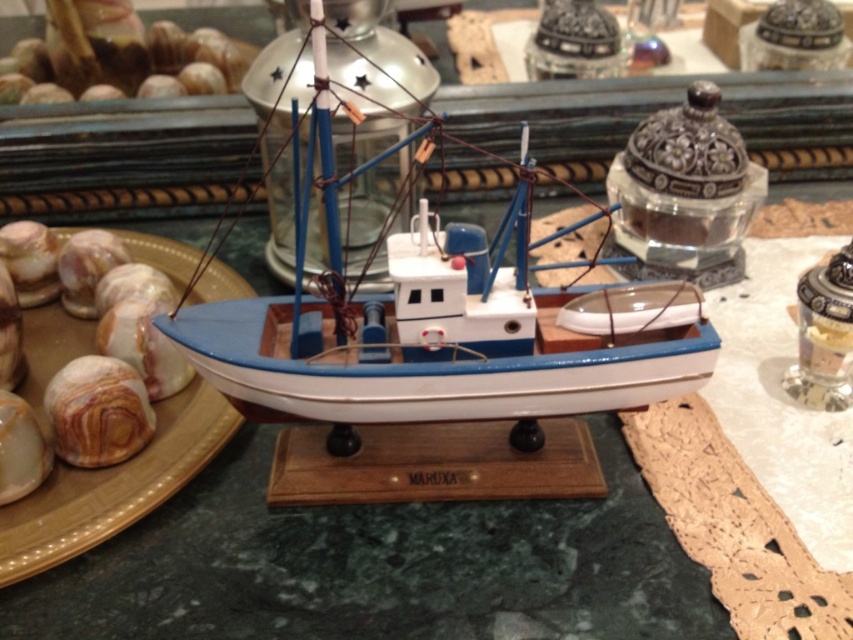
Question: Which object is the closest to the matte brown plate at left?

Choices:
 (A) matte blue wooden boat at center
 (B) wooden boat at center

Answer: (B)

Question: Observing the image, what is the correct spatial positioning of wooden boat at center in reference to matte brown plate at left?

Choices:
 (A) left
 (B) right

Answer: (B)

Question: Does matte blue wooden boat at center have a smaller size compared to matte brown plate at left?

Choices:
 (A) no
 (B) yes

Answer: (A)

Question: Does matte blue wooden boat at center appear on the left side of matte brown plate at left?

Choices:
 (A) yes
 (B) no

Answer: (B)

Question: Which point is farther to the camera?

Choices:
 (A) matte blue wooden boat at center
 (B) matte brown plate at left
 (C) wooden boat at center

Answer: (B)

Question: Estimate the real-world distances between objects in this image. Which object is closer to the matte brown plate at left?

Choices:
 (A) matte blue wooden boat at center
 (B) wooden boat at center

Answer: (B)